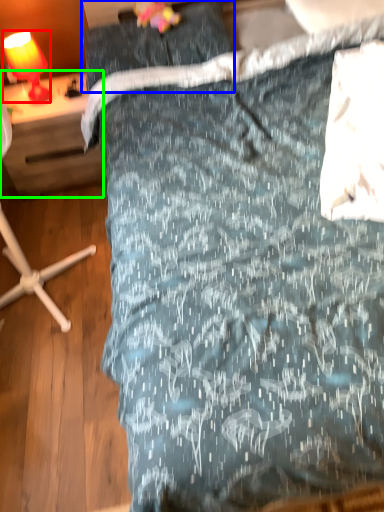
Question: Which object is the farthest from lamp (highlighted by a red box)? Choose among these: pillow (highlighted by a blue box) or desk (highlighted by a green box).

Choices:
 (A) pillow
 (B) desk

Answer: (A)